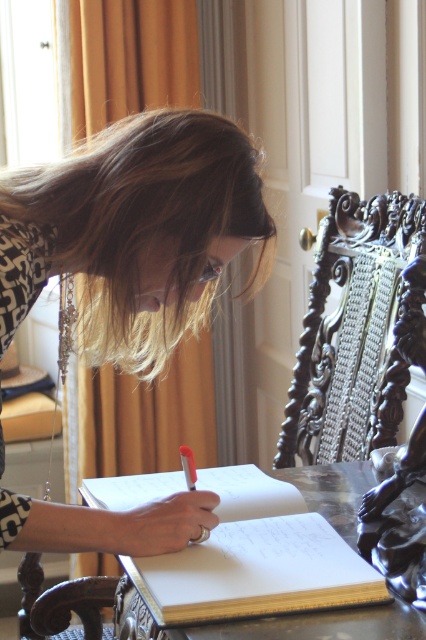
Question: Does blondehair at upper center appear on the right side of wooden table at center?

Choices:
 (A) yes
 (B) no

Answer: (B)

Question: Which of the following is the closest to the observer?

Choices:
 (A) blondehair at upper center
 (B) wooden table at center

Answer: (B)

Question: Which point is farther to the camera?

Choices:
 (A) blondehair at upper center
 (B) wooden table at center

Answer: (A)

Question: Is blondehair at upper center thinner than wooden table at center?

Choices:
 (A) yes
 (B) no

Answer: (B)

Question: Can you confirm if blondehair at upper center is positioned to the left of wooden table at center?

Choices:
 (A) no
 (B) yes

Answer: (B)